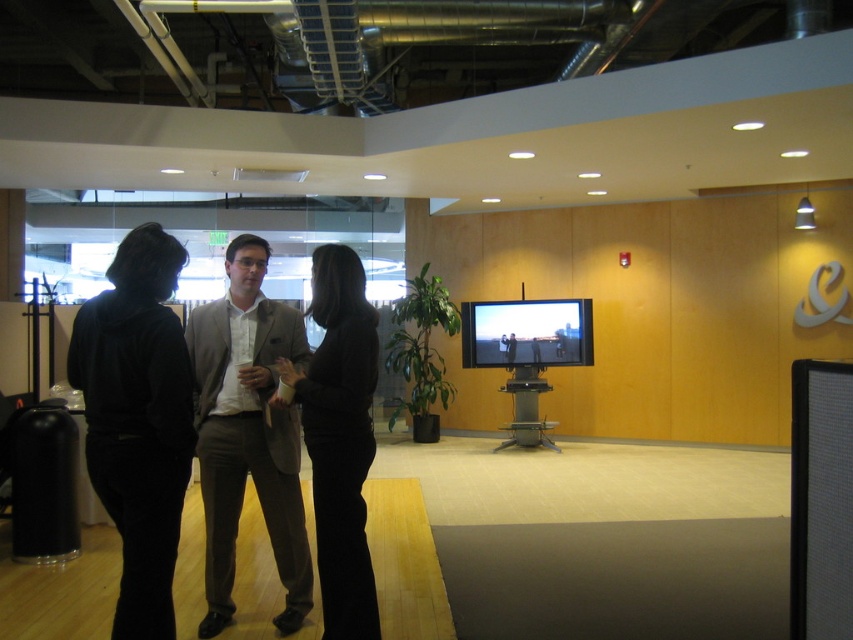
Question: Can you confirm if black matte pants at left is thinner than gray wool suit at center?

Choices:
 (A) no
 (B) yes

Answer: (B)

Question: In this image, where is dark gray suit at center located relative to gray wool suit at center?

Choices:
 (A) above
 (B) below

Answer: (A)

Question: Can you confirm if dark gray suit at center is bigger than gray wool suit at center?

Choices:
 (A) no
 (B) yes

Answer: (B)

Question: Which point appears farthest from the camera in this image?

Choices:
 (A) (97, 355)
 (B) (247, 314)
 (C) (351, 300)

Answer: (B)

Question: Estimate the real-world distances between objects in this image. Which object is closer to the gray wool suit at center?

Choices:
 (A) dark gray suit at center
 (B) black matte pants at left

Answer: (A)

Question: Which of the following is the closest to the observer?

Choices:
 (A) dark gray suit at center
 (B) black matte pants at center
 (C) gray wool suit at center

Answer: (B)